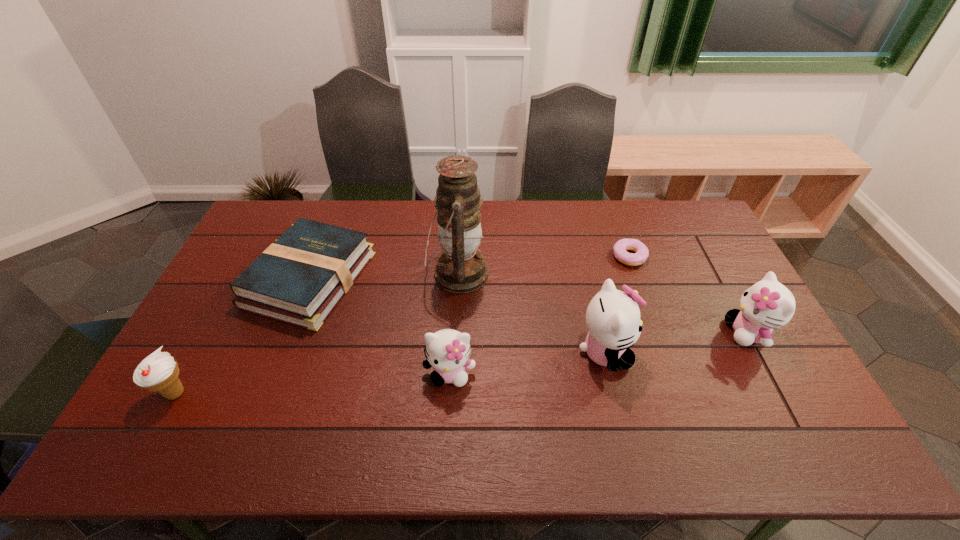
The height and width of the screenshot is (540, 960). What are the coordinates of `vacant region located 0.130m on the front-facing side of the second kitten from right to left` in the screenshot? It's located at (678, 352).

Locate an element on the screen. This screenshot has height=540, width=960. vacant region located 0.180m on the front-facing side of the rightmost kitten is located at coordinates (663, 332).

Identify the location of vacant space located on the front-facing side of the rightmost kitten. The width and height of the screenshot is (960, 540). (650, 332).

Image resolution: width=960 pixels, height=540 pixels. I want to click on vacant area situated 0.070m on the front-facing side of the rightmost kitten, so click(x=702, y=332).

Locate an element on the screen. free region located on the back of the second shortest object is located at coordinates (340, 201).

This screenshot has height=540, width=960. Find the location of `free space located on the left of the tallest object`. free space located on the left of the tallest object is located at coordinates (315, 274).

Image resolution: width=960 pixels, height=540 pixels. In order to click on vacant space located on the left of the doughnut in this screenshot , I will do `click(495, 256)`.

Identify the location of vacant point located on the right of the icecream. The image size is (960, 540). (213, 393).

Where is `object that is at the far edge`? object that is at the far edge is located at coordinates (299, 279).

Where is `kitten that is at the near edge`? This screenshot has width=960, height=540. kitten that is at the near edge is located at coordinates (448, 351).